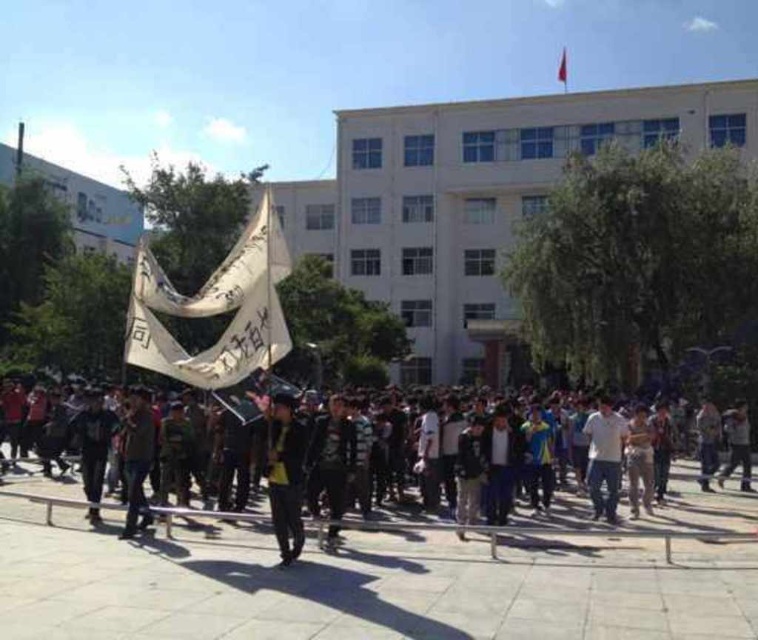
Does white paper banner at center appear over dark gray fabric crowd at center?

Yes, white paper banner at center is above dark gray fabric crowd at center.

Is white paper banner at center smaller than dark gray fabric crowd at center?

Actually, white paper banner at center might be larger than dark gray fabric crowd at center.

Does point (243, 368) come behind point (356, 520)?

No, (243, 368) is closer to viewer.

Where is `white paper banner at center`? This screenshot has width=758, height=640. white paper banner at center is located at coordinates (215, 308).

Is dark gray fabric jacket at center shorter than dark gray fabric crowd at center?

Indeed, dark gray fabric jacket at center has a lesser height compared to dark gray fabric crowd at center.

Is point (296, 492) in front of point (49, 502)?

Yes.

Is point (274, 458) positioned after point (113, 436)?

No, it is in front of (113, 436).

Identify the location of dark gray fabric jacket at center. Image resolution: width=758 pixels, height=640 pixels. (284, 476).

Between dark gray fabric jacket at center and white matte shirt at center, which one has less height?

dark gray fabric jacket at center is shorter.

Is dark gray fabric jacket at center wider than white matte shirt at center?

No, dark gray fabric jacket at center is not wider than white matte shirt at center.

Is point (271, 442) farther from viewer compared to point (594, 435)?

That is False.

Image resolution: width=758 pixels, height=640 pixels. Identify the location of dark gray fabric jacket at center. (284, 476).